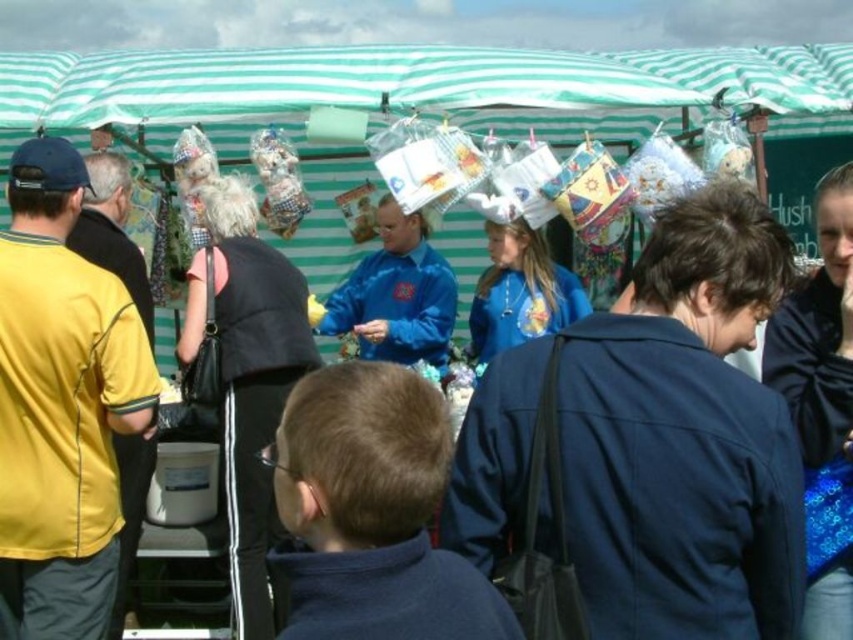
You are a vendor at the market and need to decide which jacket to display first. Since the dark blue jacket at center is wider than the blue velvet jacket at center, which jacket should you choose to place in the front to attract more attention?

The dark blue jacket at center is wider than the blue velvet jacket at center, so placing the dark blue jacket at center in the front would make it more noticeable to shoppers.

You are a photographer trying to capture a photo of the blue velvet jacket at center without including the yellow fabric shirt at left in the frame. Based on their positions, is this possible?

The yellow fabric shirt at left is below the blue velvet jacket at center, so if you position your camera to avoid looking downward, you can capture the blue velvet jacket at center without including the yellow fabric shirt at left.